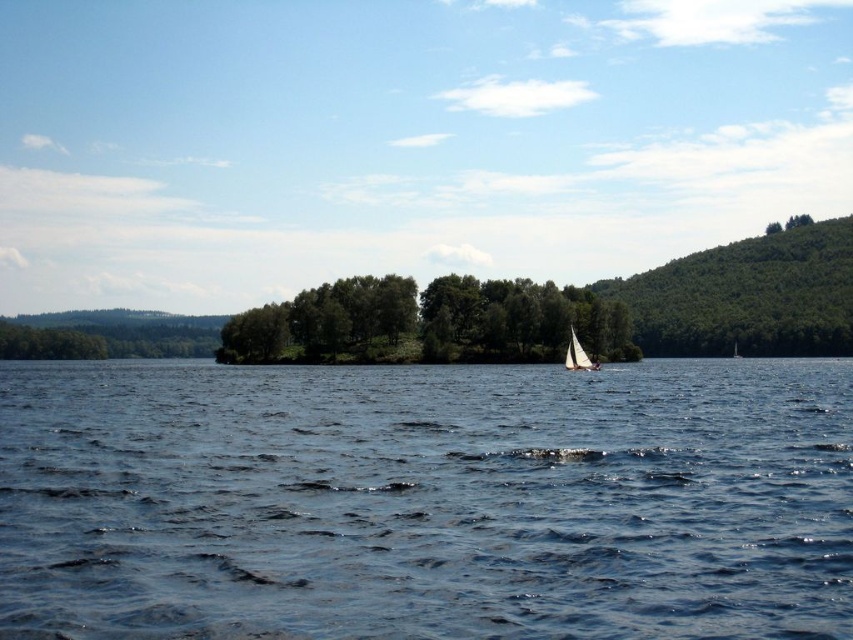
Question: Estimate the real-world distances between objects in this image. Which object is farther from the white sailboat at center?

Choices:
 (A) green leafy trees at center
 (B) blue water at center

Answer: (A)

Question: Does blue water at center have a larger size compared to green leafy trees at center?

Choices:
 (A) no
 (B) yes

Answer: (A)

Question: Which object is closer to the camera taking this photo?

Choices:
 (A) white sailboat at center
 (B) green leafy trees at center

Answer: (A)

Question: Which is farther from the green leafy trees at center?

Choices:
 (A) white sailboat at center
 (B) blue water at center

Answer: (A)

Question: Is blue water at center further to the viewer compared to green leafy trees at center?

Choices:
 (A) yes
 (B) no

Answer: (B)

Question: Can you confirm if blue water at center is positioned above green leafy trees at center?

Choices:
 (A) no
 (B) yes

Answer: (A)